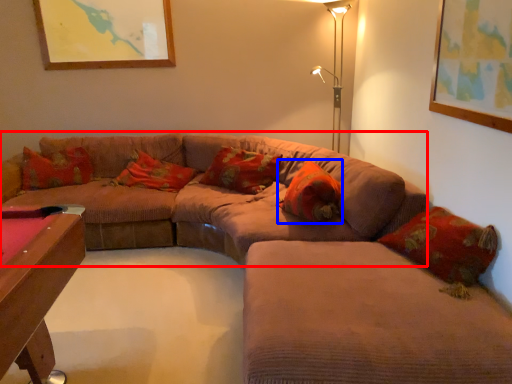
Question: Among these objects, which one is nearest to the camera, couch (highlighted by a red box) or pillow (highlighted by a blue box)?

Choices:
 (A) couch
 (B) pillow

Answer: (A)